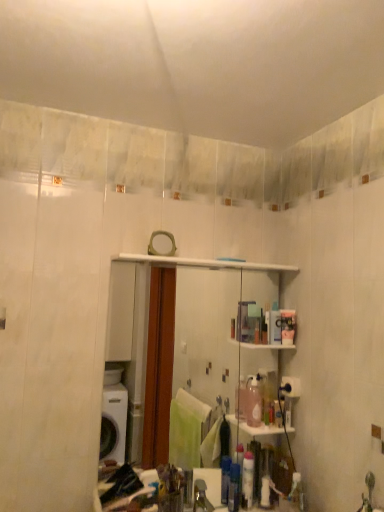
Question: From the image's perspective, is metallic silver faucet at lower center beneath clear glass mirror at center?

Choices:
 (A) yes
 (B) no

Answer: (A)

Question: Does metallic silver faucet at lower center contain clear glass mirror at center?

Choices:
 (A) no
 (B) yes

Answer: (A)

Question: Is metallic silver faucet at lower center shorter than clear glass mirror at center?

Choices:
 (A) yes
 (B) no

Answer: (A)

Question: Is metallic silver faucet at lower center positioned before clear glass mirror at center?

Choices:
 (A) no
 (B) yes

Answer: (B)

Question: Are metallic silver faucet at lower center and clear glass mirror at center located far from each other?

Choices:
 (A) yes
 (B) no

Answer: (B)

Question: In the image, is clear glass mirror at center on the left side or the right side of translucent plastic container at upper right?

Choices:
 (A) left
 (B) right

Answer: (A)

Question: Is point (215, 265) closer or farther from the camera than point (291, 320)?

Choices:
 (A) closer
 (B) farther

Answer: (A)

Question: From the image's perspective, is clear glass mirror at center positioned above or below translucent plastic container at upper right?

Choices:
 (A) above
 (B) below

Answer: (B)

Question: Is clear glass mirror at center bigger or smaller than translucent plastic container at upper right?

Choices:
 (A) small
 (B) big

Answer: (B)

Question: From the image's perspective, is metallic silver faucet at lower center above or below clear glass mirror at center?

Choices:
 (A) below
 (B) above

Answer: (A)

Question: Which is correct: metallic silver faucet at lower center is inside clear glass mirror at center, or outside of it?

Choices:
 (A) outside
 (B) inside

Answer: (A)

Question: Is metallic silver faucet at lower center to the left or to the right of clear glass mirror at center in the image?

Choices:
 (A) right
 (B) left

Answer: (A)

Question: From a real-world perspective, relative to clear glass mirror at center, is metallic silver faucet at lower center vertically above or below?

Choices:
 (A) above
 (B) below

Answer: (B)

Question: In terms of width, does clear glass mirror at center look wider or thinner when compared to metallic silver faucet at lower center?

Choices:
 (A) wide
 (B) thin

Answer: (B)

Question: In the image, is clear glass mirror at center on the left side or the right side of metallic silver faucet at lower center?

Choices:
 (A) left
 (B) right

Answer: (A)